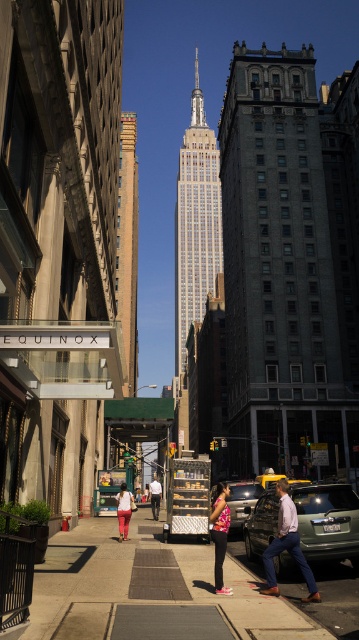
Does green matte car at center appear over brick textured building at center?

No, green matte car at center is not above brick textured building at center.

Does green matte car at center come in front of brick textured building at center?

That is True.

I want to click on green matte car at center, so click(327, 522).

Which is in front, point (266, 321) or point (276, 582)?

Positioned in front is point (276, 582).

Find the location of a particular element. This screenshot has height=640, width=359. dark gray stone building at center is located at coordinates (288, 266).

Which of these two, dark gray stone building at center or matte pink pants at center, stands shorter?

matte pink pants at center is shorter.

Between point (281, 396) and point (127, 502), which one is positioned behind?

Point (281, 396)

I want to click on dark gray stone building at center, so click(x=288, y=266).